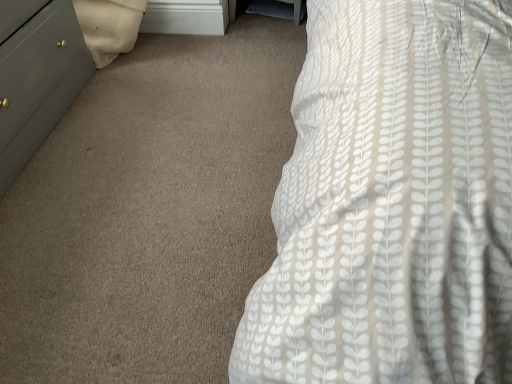
Question: Is white matte file cabinet at upper center in front of or behind matte gray dresser at left in the image?

Choices:
 (A) behind
 (B) front

Answer: (A)

Question: Looking at their shapes, would you say white matte file cabinet at upper center is wider or thinner than matte gray dresser at left?

Choices:
 (A) thin
 (B) wide

Answer: (A)

Question: Considering the positions of point (200, 24) and point (71, 21), is point (200, 24) closer or farther from the camera than point (71, 21)?

Choices:
 (A) farther
 (B) closer

Answer: (A)

Question: From a real-world perspective, relative to white matte file cabinet at upper center, is matte gray dresser at left vertically above or below?

Choices:
 (A) above
 (B) below

Answer: (A)

Question: In terms of height, does matte gray dresser at left look taller or shorter compared to white matte file cabinet at upper center?

Choices:
 (A) short
 (B) tall

Answer: (B)

Question: Looking at the image, does matte gray dresser at left seem bigger or smaller compared to white matte file cabinet at upper center?

Choices:
 (A) small
 (B) big

Answer: (B)

Question: Relative to white matte file cabinet at upper center, is matte gray dresser at left in front or behind?

Choices:
 (A) behind
 (B) front

Answer: (B)